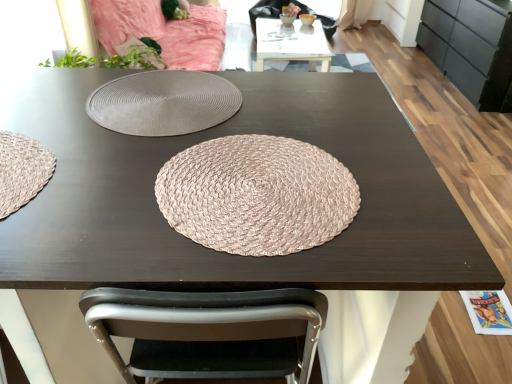
This screenshot has height=384, width=512. In order to click on vacant area that is situated to the right of matte gray placemat at center in this screenshot , I will do `click(298, 107)`.